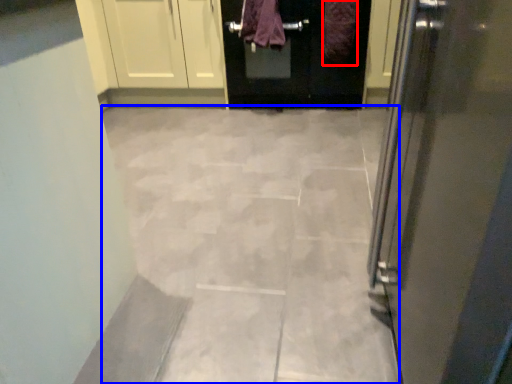
Question: Which object appears farthest to the camera in this image, blanket (highlighted by a red box) or ceramic tile (highlighted by a blue box)?

Choices:
 (A) blanket
 (B) ceramic tile

Answer: (A)